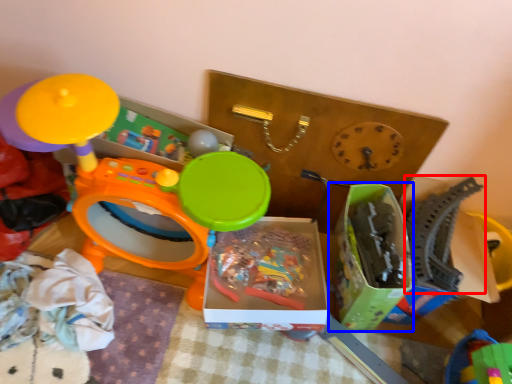
Question: Which object appears closest to the camera in this image, toy (highlighted by a red box) or storage box (highlighted by a blue box)?

Choices:
 (A) toy
 (B) storage box

Answer: (B)